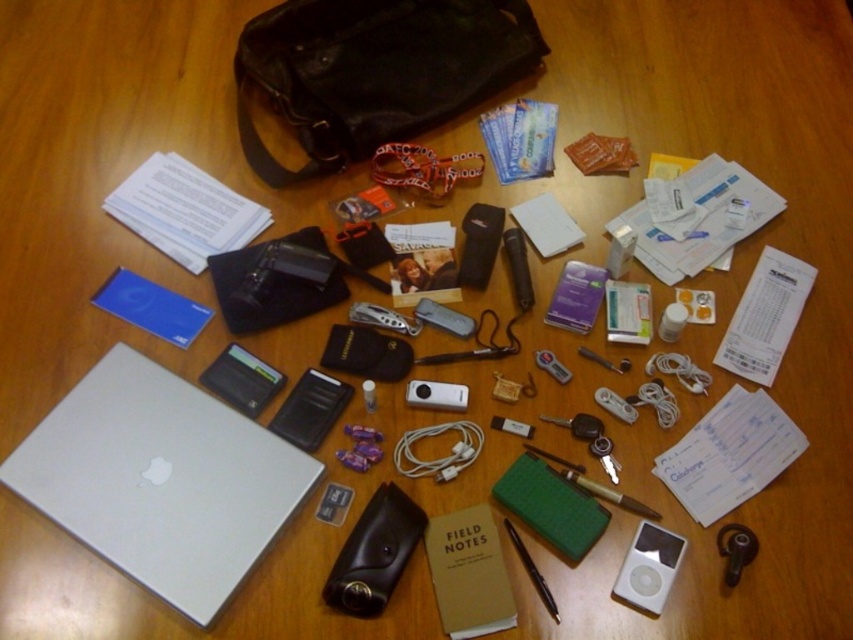
You are organizing items on a wooden desk. You have a black leather bag at upper center. Where exactly is the black leather bag located on the desk?

The black leather bag at upper center is located at the 2D coordinates point [374,72] on the desk.

You are organizing your desk and need to place the silver metallic laptop at lower left and the black matte pen at center into their respective cases. Which item should you put away first if you want to access the other item without moving the first one?

You should put away the black matte pen at center first because the silver metallic laptop at lower left is in front of it. If you move the laptop first, you would have to move it again to access the pen, so starting with the pen allows you to place it without disturbing the laptop.

You are organizing items on a wooden desk and need to place a black leather bag at upper center and a black matte pen at center. According to the scene, where should you position the black leather bag relative to the black matte pen?

The black leather bag at upper center should be positioned to the left of the black matte pen at center.